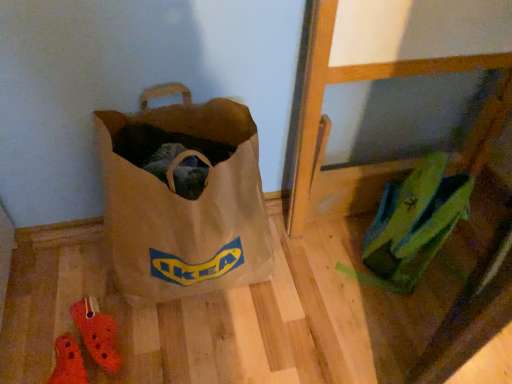
In order to click on vacant space to the left of green fabric backpack at upper right in this screenshot , I will do `click(319, 256)`.